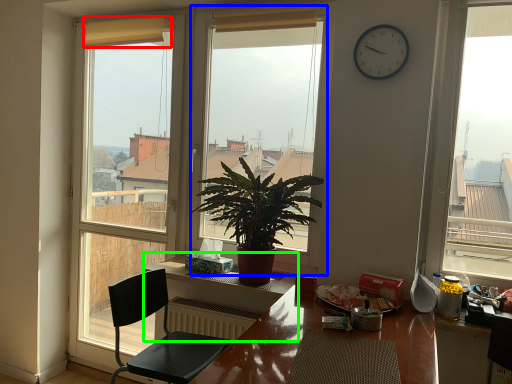
Question: Which is nearer to the curtain (highlighted by a red box)? window (highlighted by a blue box) or table (highlighted by a green box).

Choices:
 (A) window
 (B) table

Answer: (B)